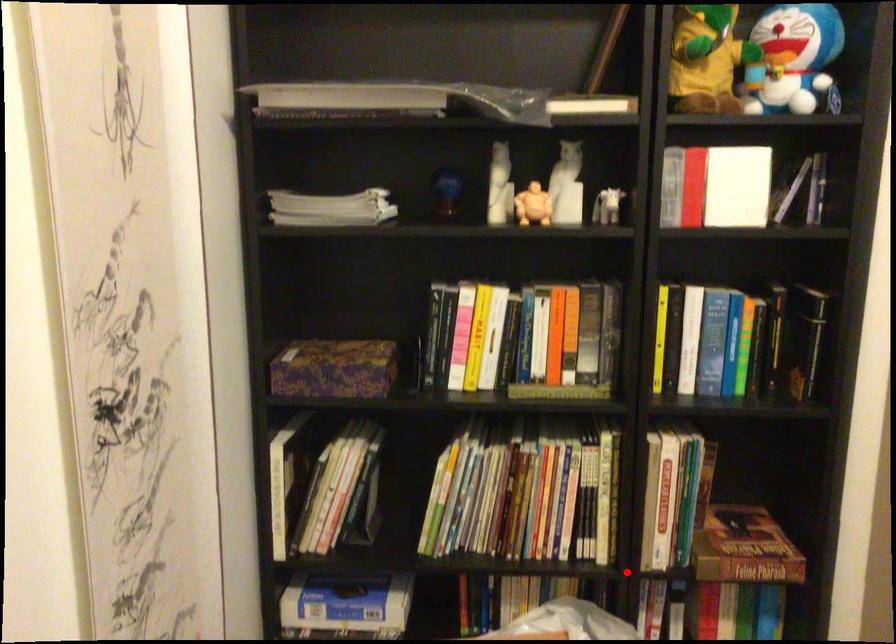
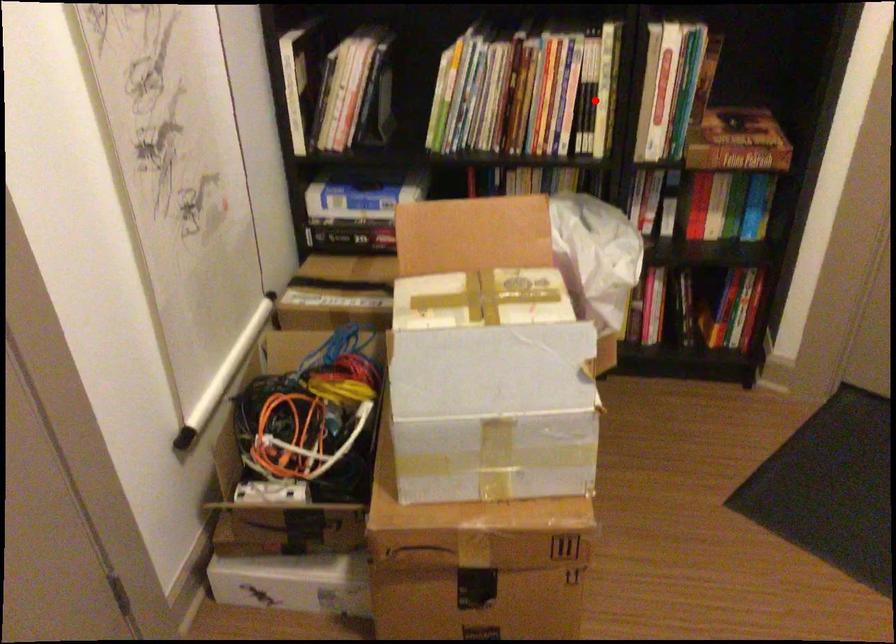
I am providing you with two images of the same scene from different viewpoints. A red point is marked on the first image and another point is marked on the second image. Does the point marked in image1 correspond to the same location as the one in image2?

No